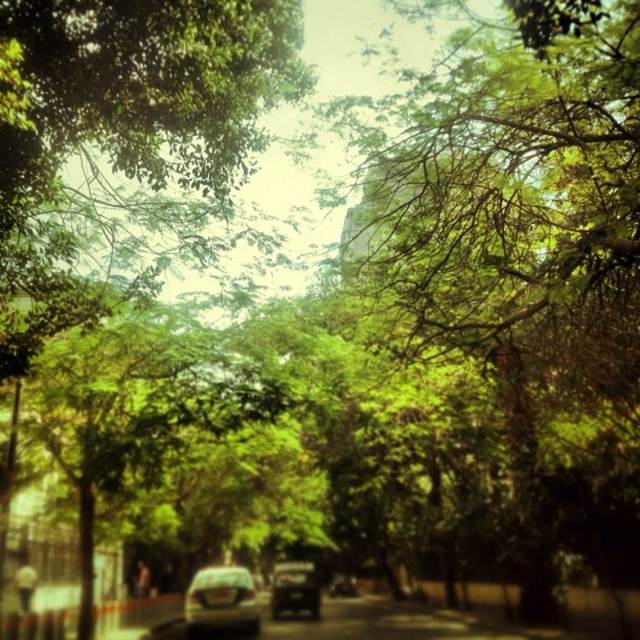
You are driving a car that is 2 meters long and want to park between the matte silver car at center and the shiny black car at center. Is there enough space to park your car between them?

The distance between the matte silver car at center and the shiny black car at center is 2.22 meters. Since your car is 2 meters long, there is enough space to park between them as the available space is slightly larger than the car length.

You are driving a car and want to park in this street. There are two cars already parked here, the matte silver car at center and the shiny black car at center. Which one is closer to the left side of the road?

The matte silver car at center is to the left of the shiny black car at center, so it is closer to the left side of the road.